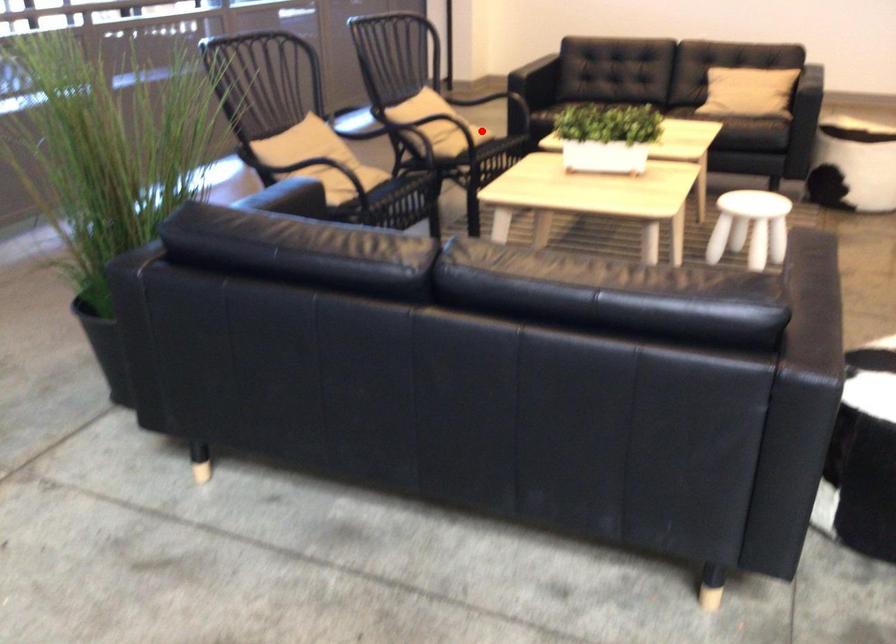
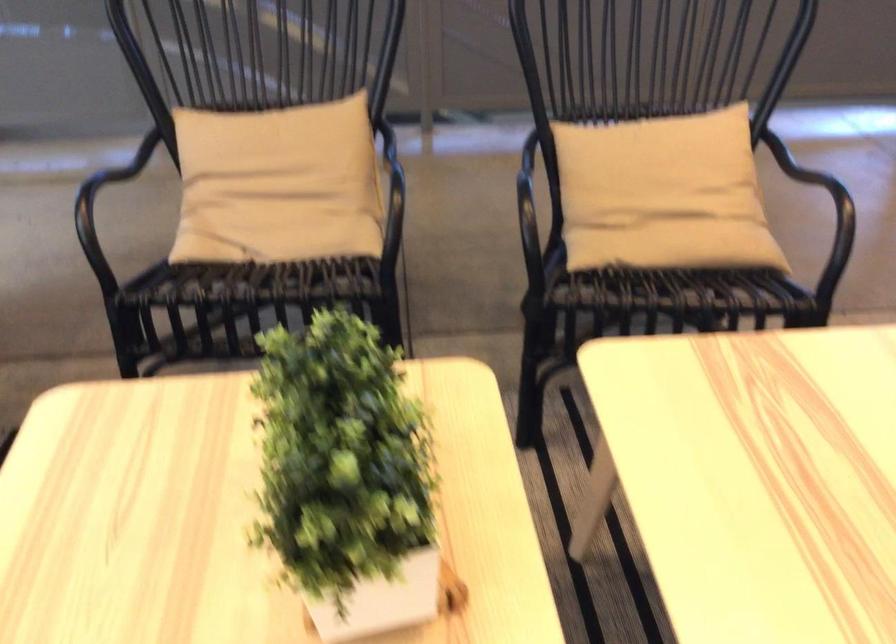
The point at the highlighted location is marked in the first image. Where is the corresponding point in the second image?

(674, 245)